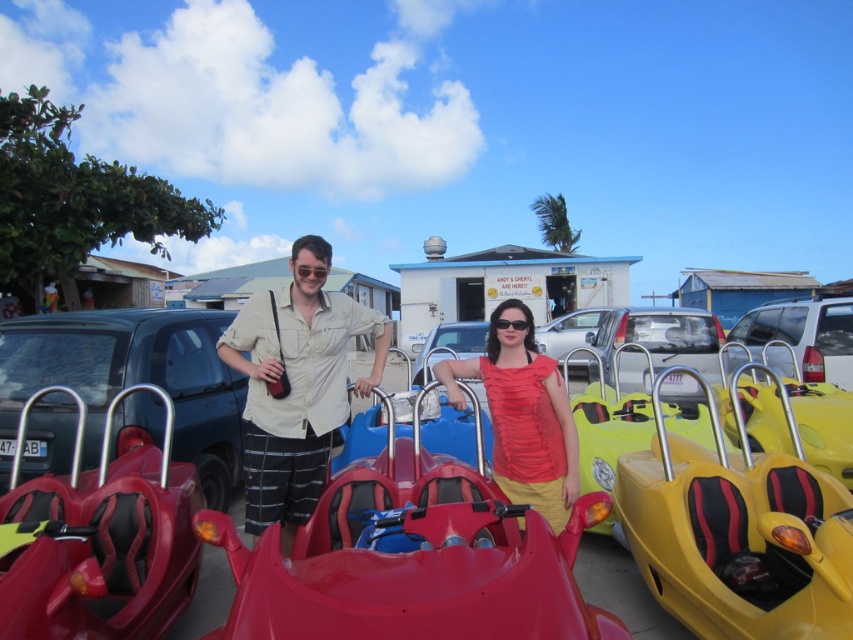
Does shiny plastic toy car at center appear on the right side of matte red shirt at center?

In fact, shiny plastic toy car at center is to the left of matte red shirt at center.

Does shiny plastic toy car at center have a lesser width compared to matte red shirt at center?

No, shiny plastic toy car at center is not thinner than matte red shirt at center.

Between point (471, 595) and point (548, 451), which one is positioned behind?

Positioned behind is point (548, 451).

You are a GUI agent. You are given a task and a screenshot of the screen. Output one action in this format:
    pyautogui.click(x=<x>, y=<y>)
    Task: Click on the shiny plastic toy car at center
    This screenshot has height=640, width=853.
    Given the screenshot: What is the action you would take?
    pyautogui.click(x=413, y=568)

This screenshot has width=853, height=640. I want to click on matte red scooter at center, so click(296, 385).

Is matte red scooter at center above white matte suv at center?

Correct, matte red scooter at center is located above white matte suv at center.

The height and width of the screenshot is (640, 853). In order to click on matte red scooter at center in this screenshot , I will do `click(296, 385)`.

Locate an element on the screen. Image resolution: width=853 pixels, height=640 pixels. matte red scooter at center is located at coordinates [296, 385].

Does metallic red toy car at left have a lesser width compared to matte red scooter at center?

Correct, metallic red toy car at left's width is less than matte red scooter at center's.

Between metallic red toy car at left and matte red scooter at center, which one appears on the left side from the viewer's perspective?

From the viewer's perspective, metallic red toy car at left appears more on the left side.

Describe the element at coordinates (99, 538) in the screenshot. This screenshot has height=640, width=853. I see `metallic red toy car at left` at that location.

This screenshot has width=853, height=640. Find the location of `metallic red toy car at left`. metallic red toy car at left is located at coordinates coord(99,538).